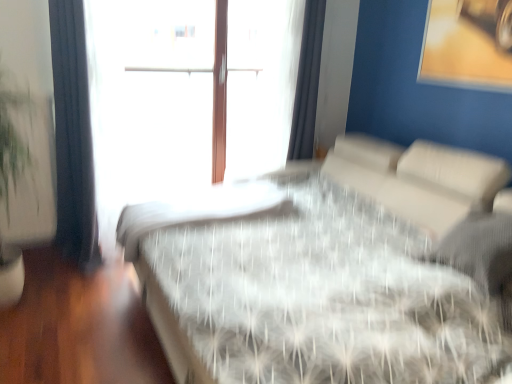
Question: Would you say white sheer curtain at upper right, which is counted as the second curtain, starting from the left, is to the left or to the right of white textured bed at center in the picture?

Choices:
 (A) right
 (B) left

Answer: (A)

Question: From a real-world perspective, is white sheer curtain at upper right, placed as the first curtain when sorted from back to front, above or below white textured bed at center?

Choices:
 (A) below
 (B) above

Answer: (B)

Question: Which object is the farthest from the white textured bed at center?

Choices:
 (A) white sheer curtain at upper right, placed as the first curtain when sorted from back to front
 (B) dark blue fabric curtain at left, which appears as the first curtain when viewed from the front
 (C) white textured mattress at center

Answer: (B)

Question: Which object is the closest to the dark blue fabric curtain at left, which appears as the second curtain when viewed from the back?

Choices:
 (A) white sheer curtain at upper right, arranged as the 1th curtain when viewed from the right
 (B) white textured mattress at center
 (C) white textured bed at center

Answer: (B)